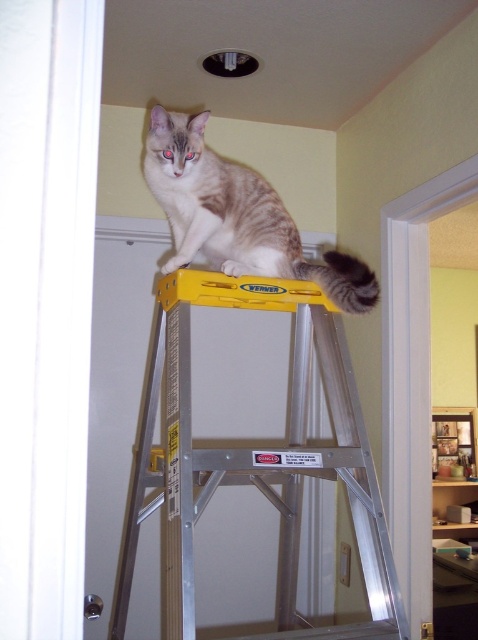
Question: Is yellow metallic ladder at upper center smaller than tabby fur cat at center?

Choices:
 (A) yes
 (B) no

Answer: (B)

Question: Is yellow metallic ladder at upper center above tabby fur cat at center?

Choices:
 (A) no
 (B) yes

Answer: (A)

Question: Which object appears farthest from the camera in this image?

Choices:
 (A) tabby fur cat at center
 (B) yellow metallic ladder at upper center

Answer: (A)

Question: Which point is farther to the camera?

Choices:
 (A) (391, 556)
 (B) (186, 241)

Answer: (B)

Question: Can you confirm if yellow metallic ladder at upper center is thinner than tabby fur cat at center?

Choices:
 (A) yes
 (B) no

Answer: (B)

Question: Which object is farther from the camera taking this photo?

Choices:
 (A) tabby fur cat at center
 (B) yellow metallic ladder at upper center

Answer: (A)